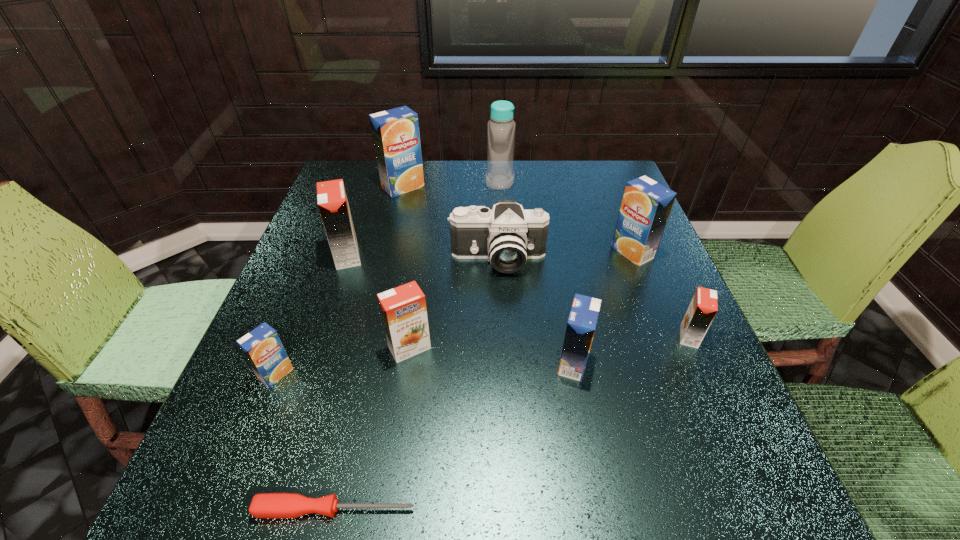
The width and height of the screenshot is (960, 540). I want to click on the third biggest blue orange_juice, so click(x=582, y=321).

In order to click on the smallest orange orange juice in this screenshot , I will do coord(703,307).

The image size is (960, 540). I want to click on the leftmost blue orange_juice, so click(x=262, y=348).

Image resolution: width=960 pixels, height=540 pixels. I want to click on screwdriver, so click(264, 505).

This screenshot has width=960, height=540. I want to click on the shortest object, so click(264, 505).

Locate an element on the screen. free space located 0.100m on the right of the blue bottle is located at coordinates (548, 181).

In order to click on free spot located on the back of the farthest blue orange_juice in this screenshot , I will do `click(408, 165)`.

Image resolution: width=960 pixels, height=540 pixels. I want to click on vacant space located on the left of the third smallest blue orange_juice, so click(x=505, y=252).

You are a GUI agent. You are given a task and a screenshot of the screen. Output one action in this format:
    pyautogui.click(x=<x>, y=<y>)
    Task: Click on the vacant space located 0.070m on the back of the biggest orange orange juice
    
    Given the screenshot: What is the action you would take?
    pyautogui.click(x=357, y=226)

Find the location of `blank area located on the front of the black camera`. blank area located on the front of the black camera is located at coordinates (505, 418).